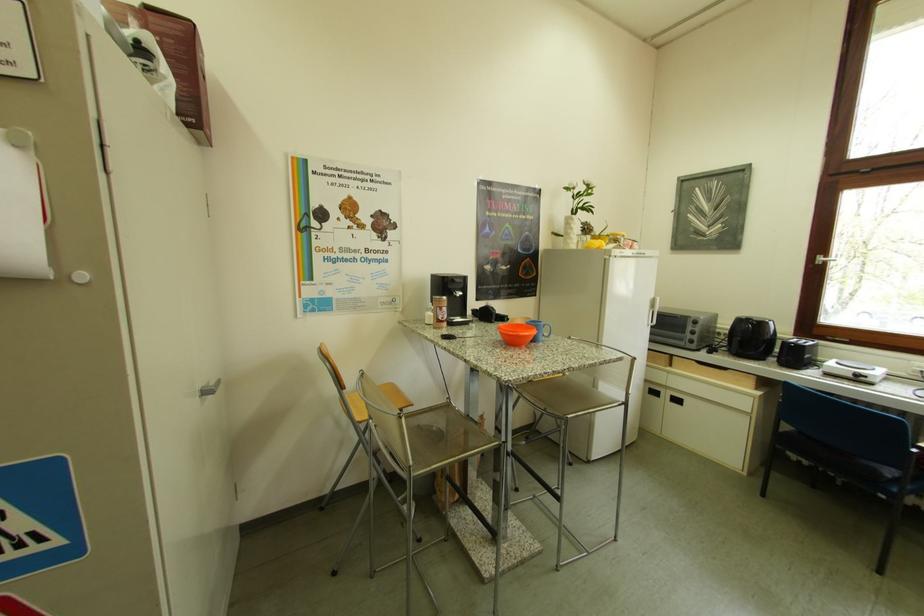
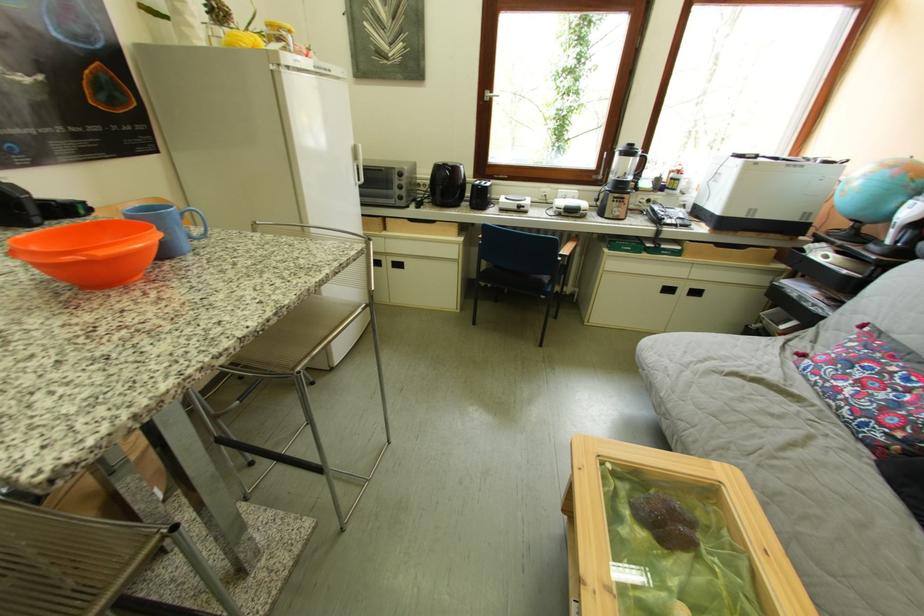
Find the pixel in the second image that matches point 706,365 in the first image.

(419, 223)